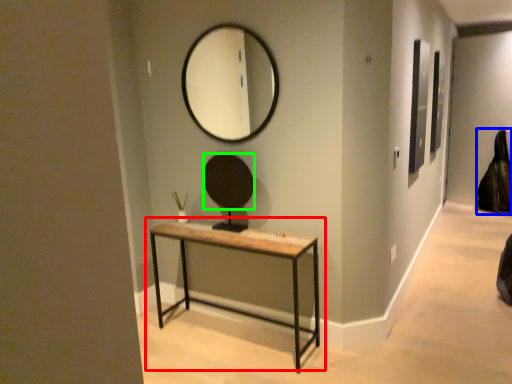
Question: Based on their relative distances, which object is nearer to table (highlighted by a red box)? Choose from swivel chair (highlighted by a blue box) and mirror (highlighted by a green box).

Choices:
 (A) swivel chair
 (B) mirror

Answer: (B)